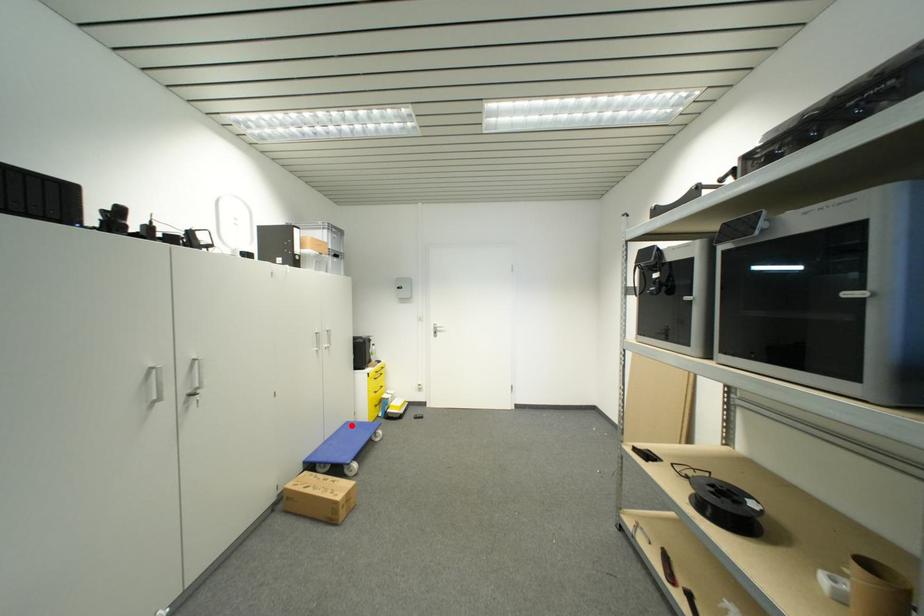
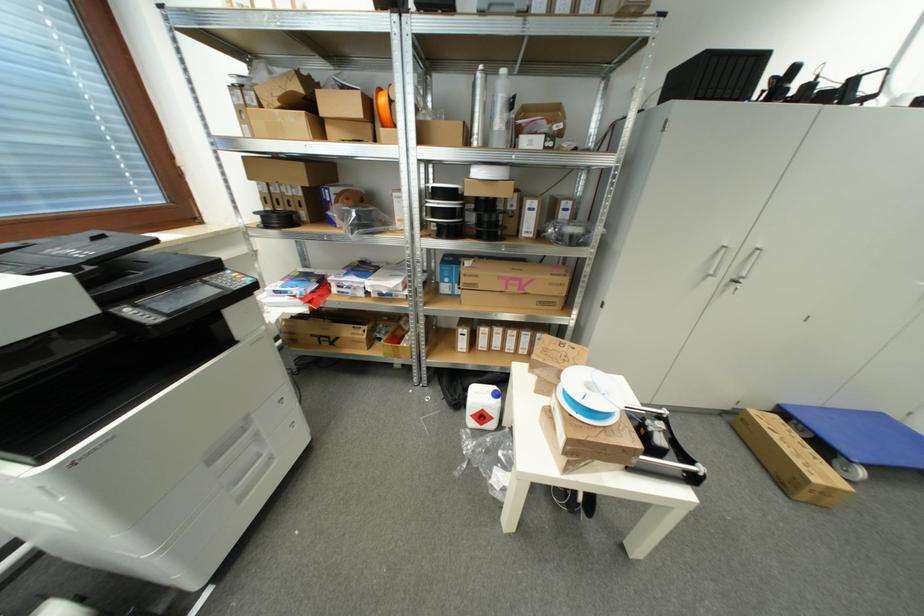
The point at the highlighted location is marked in the first image. Where is the corresponding point in the second image?

(885, 418)